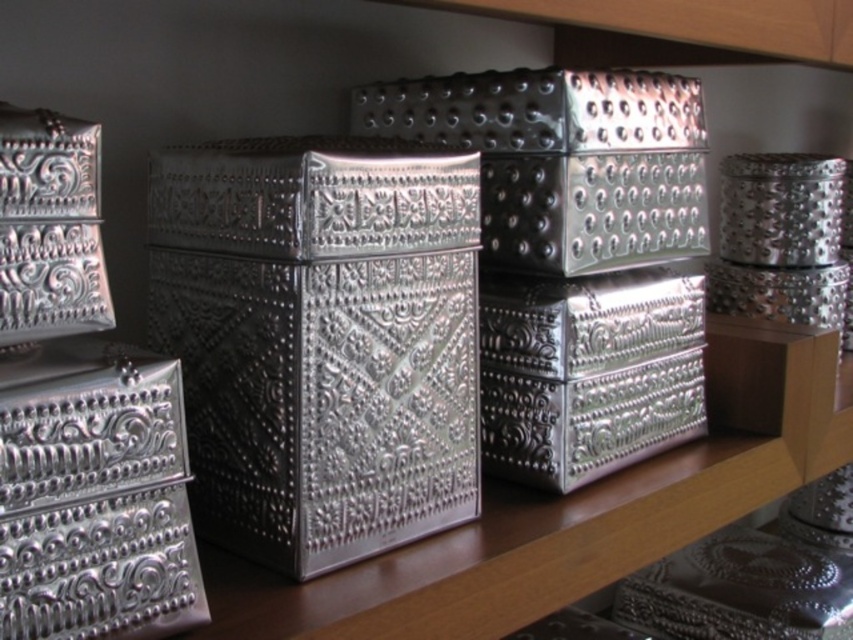
Is silver textured box at left closer to camera compared to metallic textured box at center?

That is True.

Between silver textured box at left and metallic textured box at center, which one appears on the left side from the viewer's perspective?

silver textured box at left

Does point (94, 212) come behind point (784, 547)?

No, (94, 212) is closer to viewer.

The height and width of the screenshot is (640, 853). I want to click on silver textured box at left, so click(x=49, y=227).

Between metallic silver textured box at center and silver textured box at left, which one appears on the right side from the viewer's perspective?

metallic silver textured box at center

Does point (204, 244) lie behind point (0, 125)?

Yes, it is behind point (0, 125).

This screenshot has height=640, width=853. Identify the location of metallic silver textured box at center. (320, 339).

Is point (421, 445) more distant than point (155, 433)?

Yes, point (421, 445) is farther from viewer.

Which is behind, point (398, 317) or point (126, 524)?

The point (398, 317) is behind.

Between point (218, 316) and point (22, 589), which one is positioned in front?

Point (22, 589)

I want to click on metallic silver textured box at center, so click(x=320, y=339).